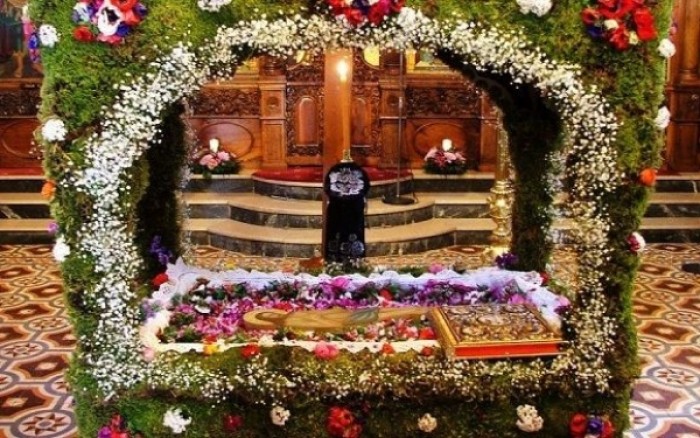
This screenshot has width=700, height=438. I want to click on carved wooden columns, so click(271, 104), click(388, 107).